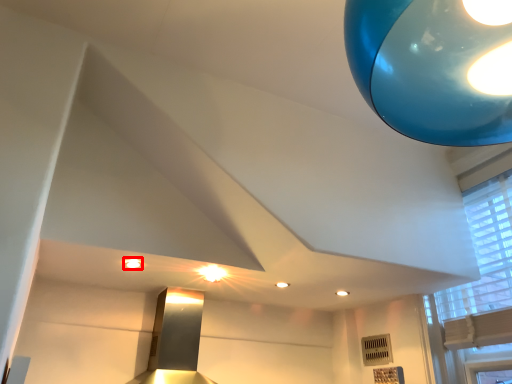
Question: From the image's perspective, what is the correct spatial positioning of lighting (annotated by the red box) in reference to window?

Choices:
 (A) below
 (B) above

Answer: (B)